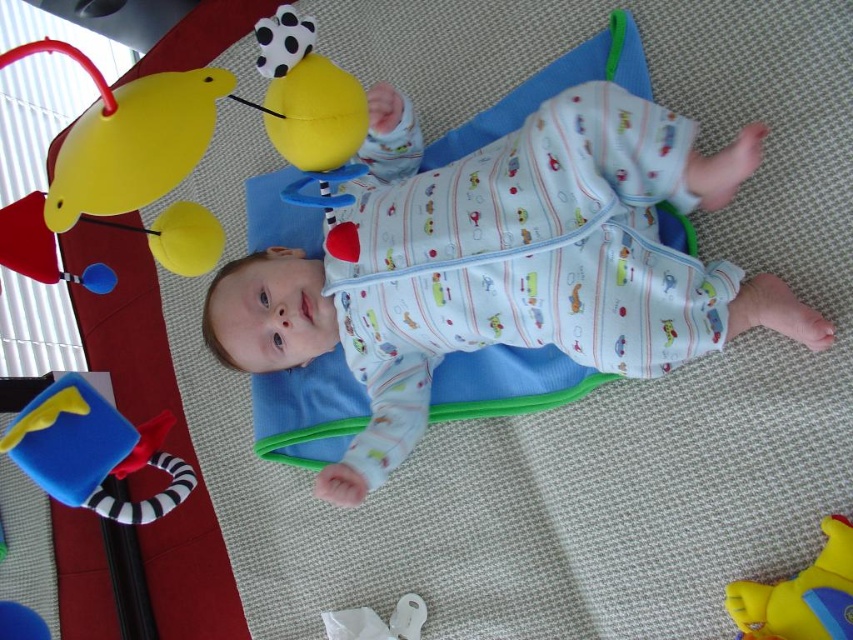
Question: Which object appears closest to the camera in this image?

Choices:
 (A) yellow rubber duck at upper left
 (B) blue rubber ring at lower left

Answer: (A)

Question: Observing the image, what is the correct spatial positioning of blue rubber ring at lower left in reference to yellow rubber duck at upper left?

Choices:
 (A) above
 (B) below

Answer: (A)

Question: Can you confirm if matte yellow duck at upper left is positioned above yellow rubber duck at upper left?

Choices:
 (A) yes
 (B) no

Answer: (A)

Question: Can you confirm if white cotton onesie at center is positioned to the right of matte yellow duck at upper left?

Choices:
 (A) no
 (B) yes

Answer: (B)

Question: Which object appears farthest from the camera in this image?

Choices:
 (A) white cotton onesie at center
 (B) matte yellow duck at upper left
 (C) yellow rubber duck at upper left
 (D) blue rubber ring at lower left

Answer: (A)

Question: Which point appears farthest from the camera in this image?

Choices:
 (A) (105, 440)
 (B) (59, 200)
 (C) (828, 592)

Answer: (A)